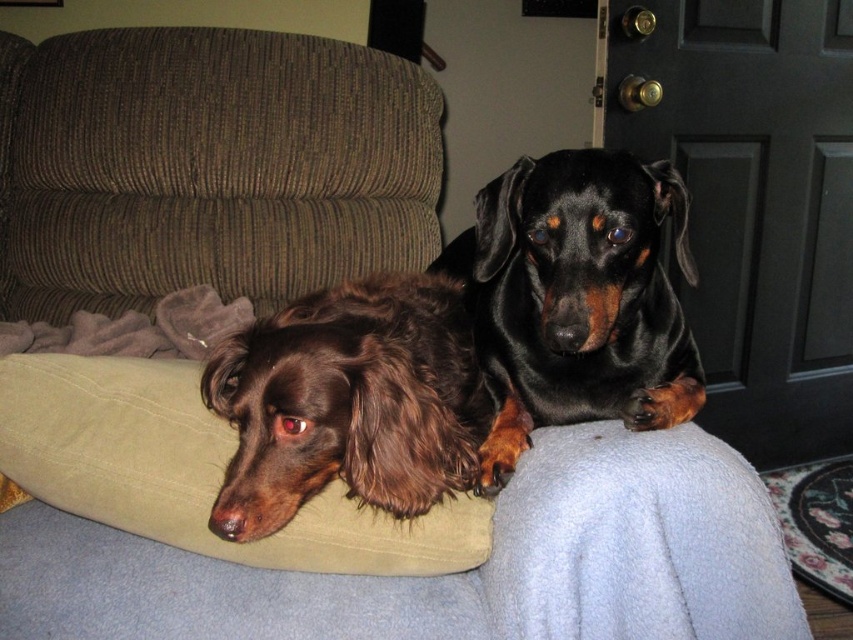
Does black shiny coat at upper center have a lesser width compared to suede-like beige pillow at lower left?

Yes.

Who is positioned more to the left, black shiny coat at upper center or suede-like beige pillow at lower left?

From the viewer's perspective, suede-like beige pillow at lower left appears more on the left side.

Measure the distance between point [585,387] and camera.

The distance of point [585,387] from camera is 38.51 inches.

What are the coordinates of `black shiny coat at upper center` in the screenshot? It's located at (576, 298).

Can you confirm if brown fabric dog bed at center is shorter than suede-like beige pillow at lower left?

No, brown fabric dog bed at center is not shorter than suede-like beige pillow at lower left.

Can you confirm if brown fabric dog bed at center is bigger than suede-like beige pillow at lower left?

Indeed, brown fabric dog bed at center has a larger size compared to suede-like beige pillow at lower left.

Find the location of `brown fabric dog bed at center`. brown fabric dog bed at center is located at coordinates (369, 532).

Is point (438, 621) more distant than point (296, 470)?

Yes, point (438, 621) is farther from viewer.

Which of these two, brown fabric dog bed at center or brown fuzzy dog at center, stands taller?

brown fabric dog bed at center

Image resolution: width=853 pixels, height=640 pixels. What do you see at coordinates (369, 532) in the screenshot?
I see `brown fabric dog bed at center` at bounding box center [369, 532].

Identify the location of brown fabric dog bed at center. (369, 532).